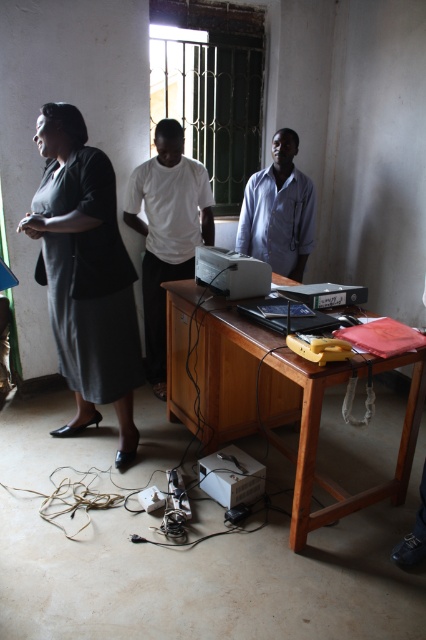
Question: Can you confirm if white matte shirt at center is positioned below yellow plastic bag at lower right?

Choices:
 (A) yes
 (B) no

Answer: (B)

Question: Does dark gray fabric dress at left come behind white matte shirt at center?

Choices:
 (A) no
 (B) yes

Answer: (A)

Question: Is white matte shirt at center smaller than white plastic printer at center?

Choices:
 (A) yes
 (B) no

Answer: (B)

Question: Which point is farther from the camera taking this photo?

Choices:
 (A) (281, 262)
 (B) (226, 387)
 (C) (216, 253)
 (D) (316, 346)

Answer: (A)

Question: Among these points, which one is farthest from the camera?

Choices:
 (A) (339, 508)
 (B) (333, 284)
 (C) (258, 232)

Answer: (C)

Question: Which of these objects is positioned farthest from the yellow plastic bag at lower right?

Choices:
 (A) blue shirt at center
 (B) wooden table at center

Answer: (A)